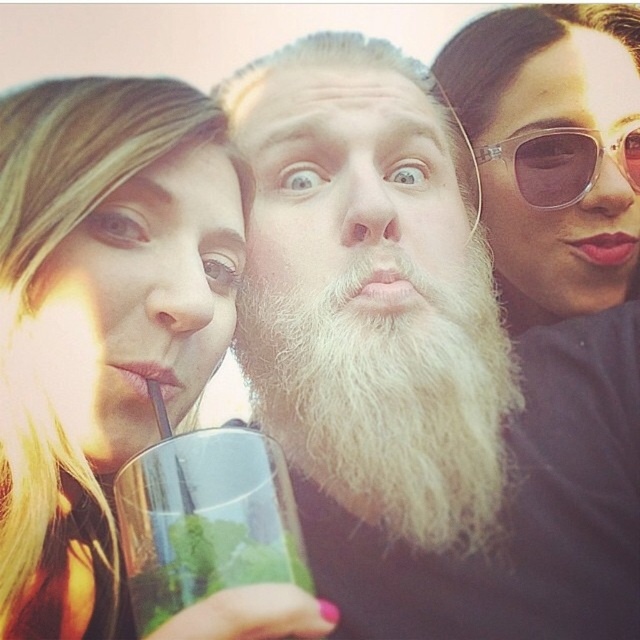
Does white beard at center have a greater width compared to white fluffy beard at center?

Yes.

Is point (372, 170) closer to camera compared to point (422, 509)?

No, (372, 170) is further to viewer.

Does point (381, 316) come farther from viewer compared to point (461, 416)?

Yes.

You are a GUI agent. You are given a task and a screenshot of the screen. Output one action in this format:
    pyautogui.click(x=<x>, y=<y>)
    Task: Click on the white beard at center
    This screenshot has width=640, height=640.
    Given the screenshot: What is the action you would take?
    pyautogui.click(x=422, y=371)

Is white fluffy beard at center bigger than clear glass at center?

Yes, white fluffy beard at center is bigger than clear glass at center.

Does white fluffy beard at center have a lesser width compared to clear glass at center?

In fact, white fluffy beard at center might be wider than clear glass at center.

Which is in front, point (380, 528) or point (144, 464)?

Point (144, 464) is in front.

Locate an element on the screen. This screenshot has height=640, width=640. white fluffy beard at center is located at coordinates pos(388,392).

Does point (300, 460) lie in front of point (72, 129)?

No, (300, 460) is behind (72, 129).

Between point (413, 186) and point (129, 154), which one is positioned in front?

Point (129, 154)

Between point (272, 236) and point (141, 113), which one is positioned behind?

Positioned behind is point (272, 236).

Find the location of a particular element. The width and height of the screenshot is (640, 640). white beard at center is located at coordinates (422, 371).